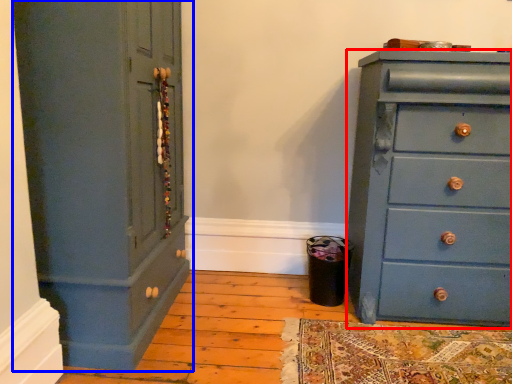
Question: Which point is further to the camera, chest of drawers (highlighted by a red box) or cupboard (highlighted by a blue box)?

Choices:
 (A) chest of drawers
 (B) cupboard

Answer: (A)